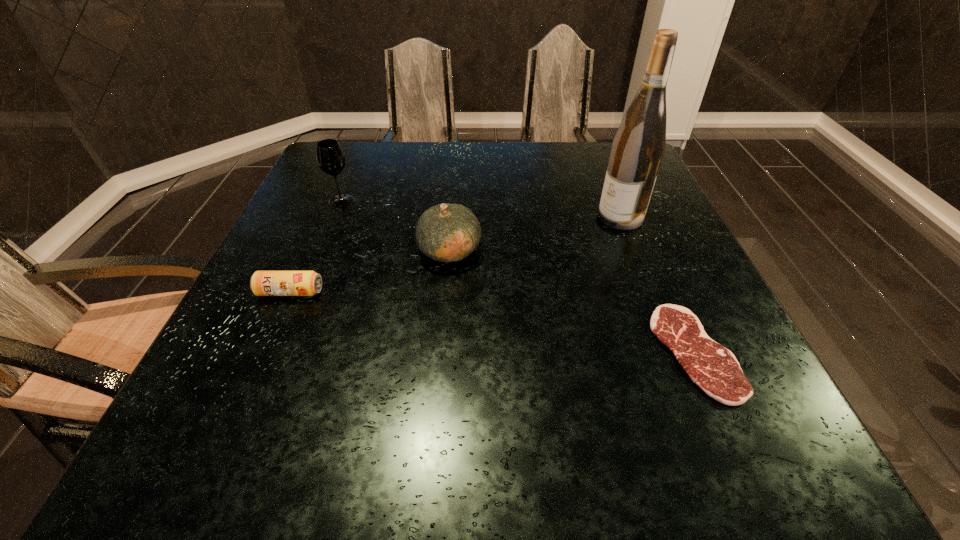
Image resolution: width=960 pixels, height=540 pixels. What are the coordinates of `wine bottle` in the screenshot? It's located at (637, 150).

Identify the location of wineglass. (330, 158).

Identify the location of the third farthest object. The image size is (960, 540). (446, 232).

Where is `gourd`? This screenshot has height=540, width=960. gourd is located at coordinates (446, 232).

Locate an element on the screen. Image resolution: width=960 pixels, height=540 pixels. beer can is located at coordinates (262, 283).

The width and height of the screenshot is (960, 540). I want to click on the second nearest object, so click(262, 283).

Where is `the shortest object`? This screenshot has width=960, height=540. the shortest object is located at coordinates (715, 369).

Image resolution: width=960 pixels, height=540 pixels. I want to click on steak, so click(715, 369).

Locate an element on the screen. The height and width of the screenshot is (540, 960). free space located 0.200m on the left of the wine bottle is located at coordinates (516, 217).

The image size is (960, 540). What are the coordinates of `blank area located 0.180m on the right of the wineglass` in the screenshot? It's located at (425, 201).